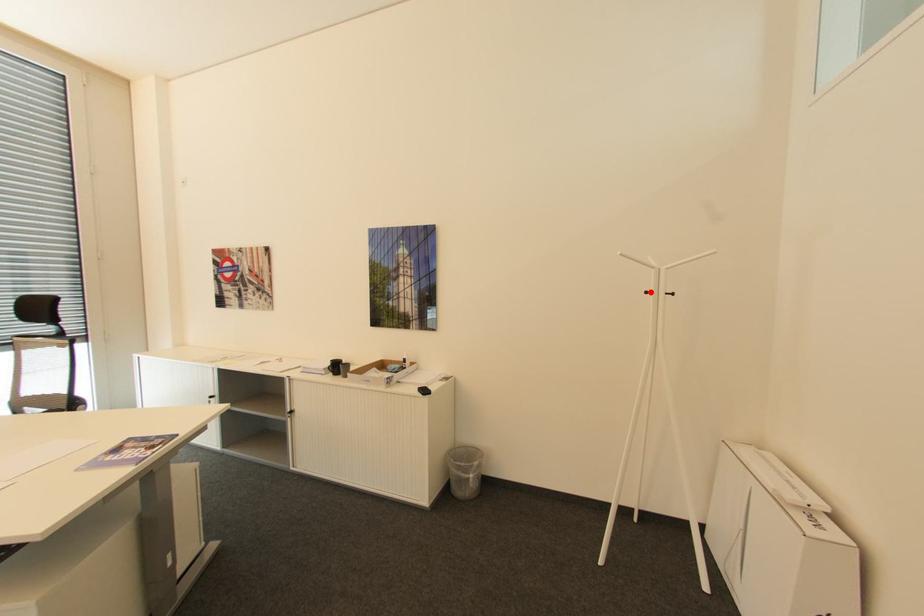
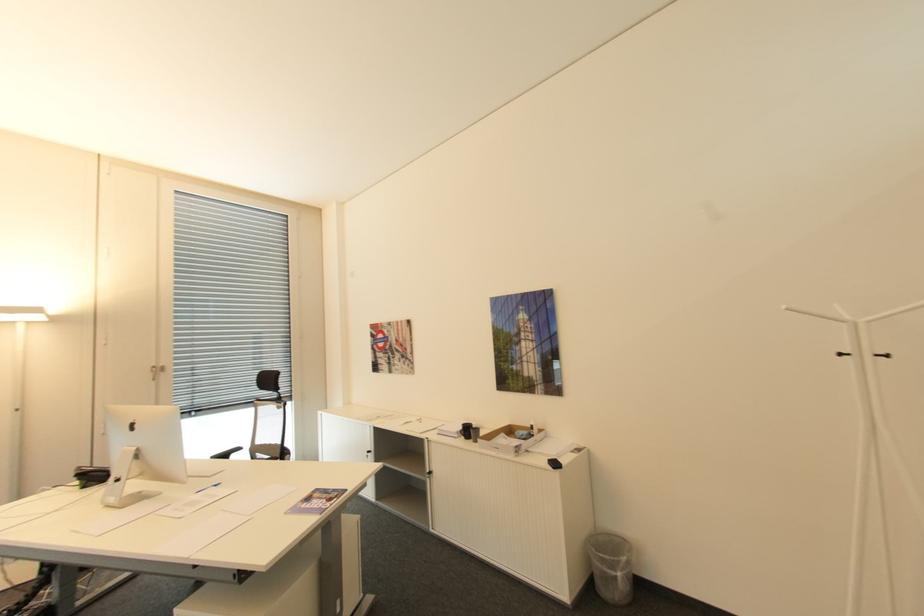
Where in the second image is the point corresponding to the highlighted location from the first image?

(846, 355)